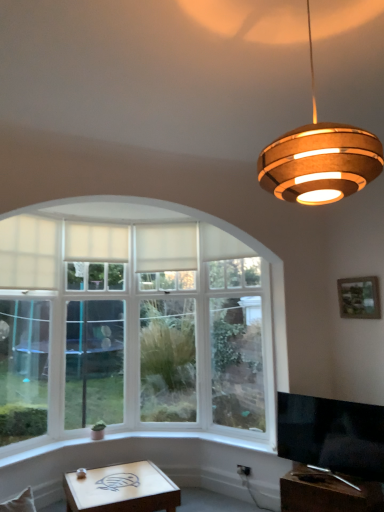
The height and width of the screenshot is (512, 384). I want to click on black glossy tv at lower right, so click(x=332, y=435).

The image size is (384, 512). Describe the element at coordinates (122, 489) in the screenshot. I see `matte white wooden table at lower center, the 2th table positioned from the right` at that location.

The height and width of the screenshot is (512, 384). I want to click on matte white wooden table at lower center, the 2th table positioned from the right, so click(x=122, y=489).

Describe the element at coordinates (359, 298) in the screenshot. The height and width of the screenshot is (512, 384). I see `wooden picture frame at upper right` at that location.

Describe the element at coordinates (319, 159) in the screenshot. I see `wooden pendant light at upper right` at that location.

In order to click on black glossy tv at lower right in this screenshot , I will do `click(332, 435)`.

Considering the sizes of objects matte white wooden table at lower center, the 2th table positioned from the right, and wooden at lower right, the first table viewed from the right, in the image provided, who is wider, matte white wooden table at lower center, the 2th table positioned from the right, or wooden at lower right, the first table viewed from the right,?

matte white wooden table at lower center, the 2th table positioned from the right.

Is matte white wooden table at lower center, positioned as the 1th table in left-to-right order, oriented towards wooden at lower right, which is counted as the 2th table, starting from the left?

No, matte white wooden table at lower center, positioned as the 1th table in left-to-right order, is not turned towards wooden at lower right, which is counted as the 2th table, starting from the left.

From the picture: Is matte white wooden table at lower center, positioned as the 1th table in left-to-right order, inside or outside of wooden at lower right, the first table viewed from the right?

matte white wooden table at lower center, positioned as the 1th table in left-to-right order, is not inside wooden at lower right, the first table viewed from the right, it's outside.

From the image's perspective, which object appears higher, matte white wooden table at lower center, positioned as the 1th table in left-to-right order, or wooden at lower right, which is counted as the 2th table, starting from the left?

wooden at lower right, which is counted as the 2th table, starting from the left, from the image's perspective.

How distant is matte white wooden table at lower center, the 2th table positioned from the right, from black glossy tv at lower right?

matte white wooden table at lower center, the 2th table positioned from the right, and black glossy tv at lower right are 4.41 feet apart.

Which point is more forward, [85,487] or [302,434]?

The point [85,487] is closer to the camera.

From a real-world perspective, which object stands above the other?

From a 3D spatial view, black glossy tv at lower right is above.

Does matte white wooden table at lower center, positioned as the 1th table in left-to-right order, come behind black glossy tv at lower right?

Yes, matte white wooden table at lower center, positioned as the 1th table in left-to-right order, is further from the camera.

From a real-world perspective, which is physically above, white fabric curtain at upper left, which appears as the second curtain when viewed from the right, or white fabric curtain at center, which ranks as the 2th curtain in left-to-right order?

white fabric curtain at upper left, which appears as the second curtain when viewed from the right, from a real-world perspective.

Is white fabric curtain at upper left, which appears as the second curtain when viewed from the right, shorter than white fabric curtain at center, marked as the first curtain in a right-to-left arrangement?

Yes.

Between white fabric curtain at upper left, which appears as the second curtain when viewed from the right, and white fabric curtain at center, which ranks as the 2th curtain in left-to-right order, which one appears on the left side from the viewer's perspective?

white fabric curtain at upper left, which appears as the second curtain when viewed from the right, is more to the left.

What's the angular difference between white fabric curtain at upper left, which appears as the 1th curtain when viewed from the left, and white fabric curtain at center, which ranks as the 2th curtain in left-to-right order,'s facing directions?

The angle between the facing direction of white fabric curtain at upper left, which appears as the 1th curtain when viewed from the left, and the facing direction of white fabric curtain at center, which ranks as the 2th curtain in left-to-right order, is 29.4 degrees.

Is wooden picture frame at upper right far from white fabric curtain at upper left, which appears as the 1th curtain when viewed from the left?

wooden picture frame at upper right is positioned a significant distance from white fabric curtain at upper left, which appears as the 1th curtain when viewed from the left.

Locate an element on the screen. picture frame on the right of white fabric curtain at upper left, which appears as the 1th curtain when viewed from the left is located at coordinates (359, 298).

Is wooden picture frame at upper right closer to camera compared to white fabric curtain at upper left, which appears as the 1th curtain when viewed from the left?

Yes, wooden picture frame at upper right is closer to the camera.

Considering the relative sizes of white fabric curtain at upper left, which appears as the 1th curtain when viewed from the left, and wooden at lower right, the first table viewed from the right, in the image provided, is white fabric curtain at upper left, which appears as the 1th curtain when viewed from the left, smaller than wooden at lower right, the first table viewed from the right,?

Indeed, white fabric curtain at upper left, which appears as the 1th curtain when viewed from the left, has a smaller size compared to wooden at lower right, the first table viewed from the right.

Would you say white fabric curtain at upper left, which appears as the second curtain when viewed from the right, is outside wooden at lower right, the first table viewed from the right?

Yes, white fabric curtain at upper left, which appears as the second curtain when viewed from the right, is outside of wooden at lower right, the first table viewed from the right.

Looking at this image, is white fabric curtain at upper left, which appears as the second curtain when viewed from the right, oriented towards wooden at lower right, which is counted as the 2th table, starting from the left?

No, white fabric curtain at upper left, which appears as the second curtain when viewed from the right, does not turn towards wooden at lower right, which is counted as the 2th table, starting from the left.

Is wooden at lower right, the first table viewed from the right, further to camera compared to wooden picture frame at upper right?

That is False.

Which is closer to the camera, (x=327, y=496) or (x=360, y=308)?

Point (x=327, y=496) is positioned closer to the camera compared to point (x=360, y=308).

Which object is wider, wooden at lower right, which is counted as the 2th table, starting from the left, or wooden picture frame at upper right?

With larger width is wooden at lower right, which is counted as the 2th table, starting from the left.

Could you tell me if wooden at lower right, which is counted as the 2th table, starting from the left, is facing wooden picture frame at upper right?

No, wooden at lower right, which is counted as the 2th table, starting from the left, is not aimed at wooden picture frame at upper right.

Which is behind, white fabric curtain at center, which ranks as the 2th curtain in left-to-right order, or clear glass door at center?

Positioned behind is white fabric curtain at center, which ranks as the 2th curtain in left-to-right order.

Could you measure the distance between white fabric curtain at center, which ranks as the 2th curtain in left-to-right order, and clear glass door at center?

white fabric curtain at center, which ranks as the 2th curtain in left-to-right order, is 32.68 inches from clear glass door at center.

In order to click on glass door on the left of white fabric curtain at center, which ranks as the 2th curtain in left-to-right order in this screenshot , I will do `click(94, 362)`.

At what (x,y) coordinates should I click in order to perform the action: click on table above the matte white wooden table at lower center, the 2th table positioned from the right (from a real-world perspective). Please return your answer as a coordinate pair (x, y). Looking at the image, I should click on (327, 492).

From a real-world perspective, count 2nd tables downward from the black glossy tv at lower right and point to it. Please provide its 2D coordinates.

[(122, 489)]

Estimate the real-world distances between objects in this image. Which object is further from clear glass door at center, wooden pendant light at upper right or matte white wooden table at lower center, the 2th table positioned from the right?

wooden pendant light at upper right is further to clear glass door at center.

When comparing their distances from wooden picture frame at upper right, does white fabric curtain at upper left, which appears as the 1th curtain when viewed from the left, or clear glass door at center seem further?

clear glass door at center.

Estimate the real-world distances between objects in this image. Which object is closer to black glossy tv at lower right, white fabric curtain at center, marked as the first curtain in a right-to-left arrangement, or wooden pendant light at upper right?

Among the two, white fabric curtain at center, marked as the first curtain in a right-to-left arrangement, is located nearer to black glossy tv at lower right.

Considering their positions, is clear glass door at center positioned further to black glossy tv at lower right than matte white wooden table at lower center, the 2th table positioned from the right?

Among the two, clear glass door at center is located further to black glossy tv at lower right.

Based on their spatial positions, is matte white wooden table at lower center, the 2th table positioned from the right, or white fabric curtain at upper left, which appears as the 1th curtain when viewed from the left, further from wooden pendant light at upper right?

white fabric curtain at upper left, which appears as the 1th curtain when viewed from the left.

When comparing their distances from wooden picture frame at upper right, does white fabric curtain at center, which ranks as the 2th curtain in left-to-right order, or black glossy tv at lower right seem further?

Based on the image, white fabric curtain at center, which ranks as the 2th curtain in left-to-right order, appears to be further to wooden picture frame at upper right.

Considering their positions, is white fabric curtain at upper left, which appears as the 1th curtain when viewed from the left, positioned closer to matte white wooden table at lower center, the 2th table positioned from the right, than wooden pendant light at upper right?

The object closer to matte white wooden table at lower center, the 2th table positioned from the right, is white fabric curtain at upper left, which appears as the 1th curtain when viewed from the left.

Considering their positions, is wooden at lower right, the first table viewed from the right, positioned closer to white fabric curtain at center, which ranks as the 2th curtain in left-to-right order, than black glossy tv at lower right?

Among the two, black glossy tv at lower right is located nearer to white fabric curtain at center, which ranks as the 2th curtain in left-to-right order.

Image resolution: width=384 pixels, height=512 pixels. Find the location of `picture frame between white fabric curtain at center, marked as the first curtain in a right-to-left arrangement, and matte white wooden table at lower center, the 2th table positioned from the right, from top to bottom`. picture frame between white fabric curtain at center, marked as the first curtain in a right-to-left arrangement, and matte white wooden table at lower center, the 2th table positioned from the right, from top to bottom is located at coordinates 359,298.

Where is `television that lies between white fabric curtain at upper left, which appears as the second curtain when viewed from the right, and matte white wooden table at lower center, positioned as the 1th table in left-to-right order, from top to bottom`? television that lies between white fabric curtain at upper left, which appears as the second curtain when viewed from the right, and matte white wooden table at lower center, positioned as the 1th table in left-to-right order, from top to bottom is located at coordinates (332, 435).

The image size is (384, 512). In order to click on table that lies between white fabric curtain at upper left, which appears as the second curtain when viewed from the right, and matte white wooden table at lower center, positioned as the 1th table in left-to-right order, from top to bottom in this screenshot , I will do `click(327, 492)`.

Image resolution: width=384 pixels, height=512 pixels. I want to click on table between clear glass door at center and wooden at lower right, the first table viewed from the right, so click(x=122, y=489).